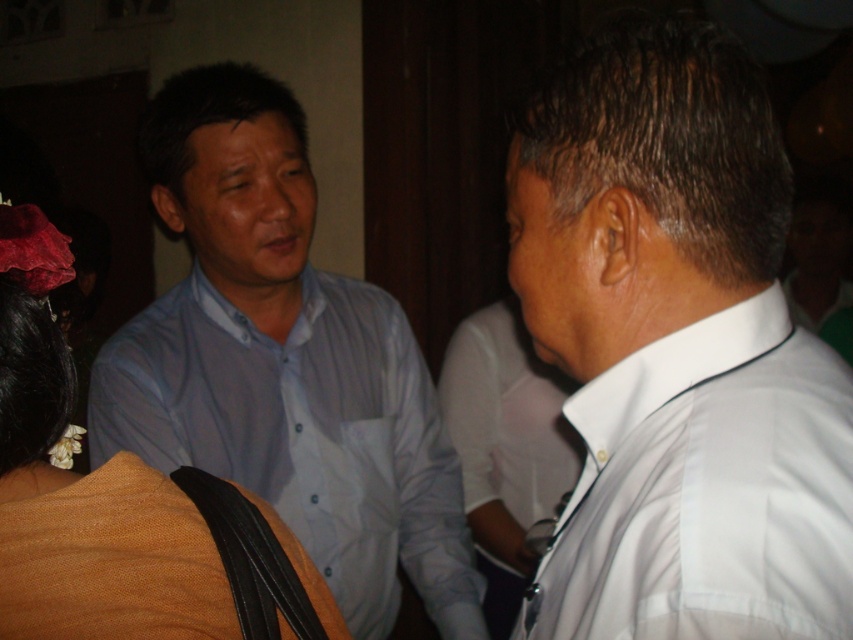
Which is behind, point (759, 396) or point (207, 531)?

The point (207, 531) is more distant.

Is point (740, 192) in front of point (73, 515)?

No, (740, 192) is further to viewer.

Image resolution: width=853 pixels, height=640 pixels. Find the location of `white smooth shirt at right`. white smooth shirt at right is located at coordinates (677, 352).

How much distance is there between white smooth shirt at right and blue button-down shirt at center?

white smooth shirt at right and blue button-down shirt at center are 75.89 centimeters apart.

Image resolution: width=853 pixels, height=640 pixels. What do you see at coordinates (677, 352) in the screenshot?
I see `white smooth shirt at right` at bounding box center [677, 352].

Identify the location of white smooth shirt at right. The image size is (853, 640). (677, 352).

Is point (436, 515) positioned in front of point (183, 627)?

No, it is behind (183, 627).

You are a GUI agent. You are given a task and a screenshot of the screen. Output one action in this format:
    pyautogui.click(x=<x>, y=<y>)
    Task: Click on the blue button-down shirt at center
    The height and width of the screenshot is (640, 853).
    Given the screenshot: What is the action you would take?
    [x=283, y=364]